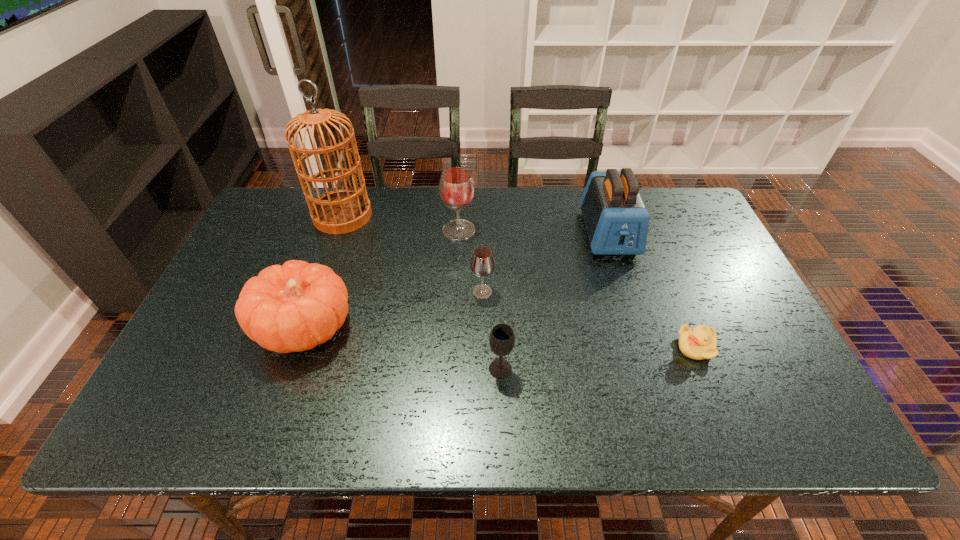
The height and width of the screenshot is (540, 960). Identify the location of the tallest object. (342, 211).

At what (x,y) coordinates should I click in order to perform the action: click on the sixth object from left to right. Please return your answer as a coordinate pair (x, y). Image resolution: width=960 pixels, height=540 pixels. Looking at the image, I should click on (616, 219).

This screenshot has height=540, width=960. Find the location of `the tallest wineglass`. the tallest wineglass is located at coordinates tap(456, 187).

Locate an element on the screen. The image size is (960, 540). pumpkin is located at coordinates (295, 307).

Identify the location of the second nearest wineglass. The width and height of the screenshot is (960, 540). (482, 264).

Identify the location of the nearest wineglass. This screenshot has width=960, height=540. (502, 338).

Where is `duckling`? The image size is (960, 540). duckling is located at coordinates (700, 342).

Find the location of a particular element. the shortest object is located at coordinates (700, 342).

This screenshot has width=960, height=540. Find the location of `free space located 0.170m on the front of the birdcage`. free space located 0.170m on the front of the birdcage is located at coordinates (322, 274).

Find the location of a particular element. The width and height of the screenshot is (960, 540). free region located on the front-facing side of the second object from right to left is located at coordinates (642, 343).